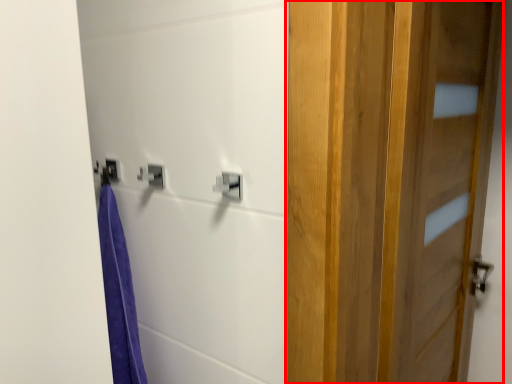
Question: From the image's perspective, what is the correct spatial relationship of door (annotated by the red box) in relation to lock?

Choices:
 (A) below
 (B) above

Answer: (A)